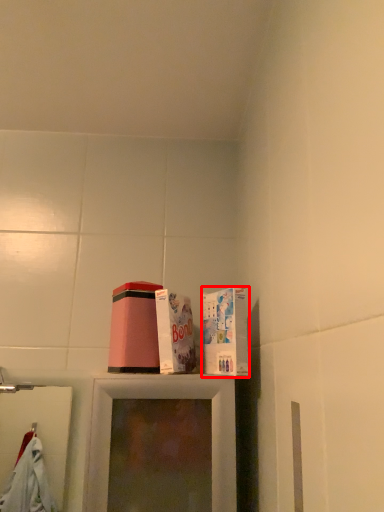
Question: From the image's perspective, considering the relative positions of box (annotated by the red box) and box in the image provided, where is box (annotated by the red box) located with respect to the staircase?

Choices:
 (A) below
 (B) above

Answer: (A)